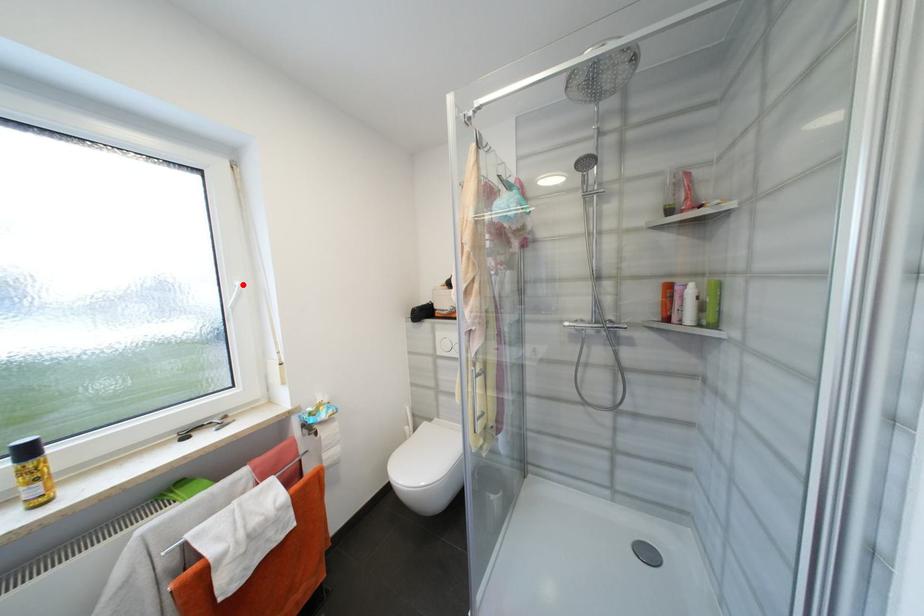
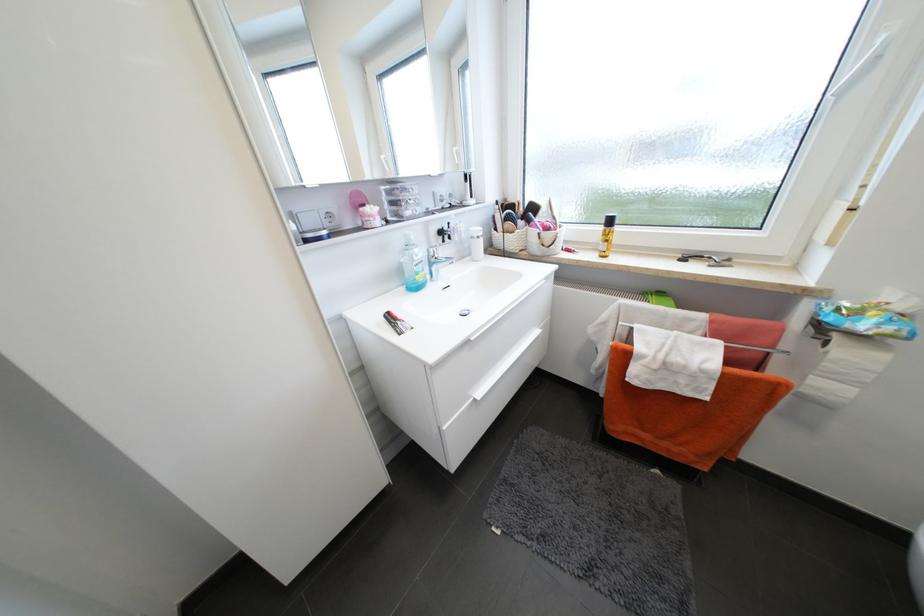
Question: I am providing you with two images of the same scene from different viewpoints. A red point is shown in image1. For the corresponding object point in image2, is it positioned nearer or farther from the camera?

Choices:
 (A) Nearer
 (B) Farther

Answer: (B)